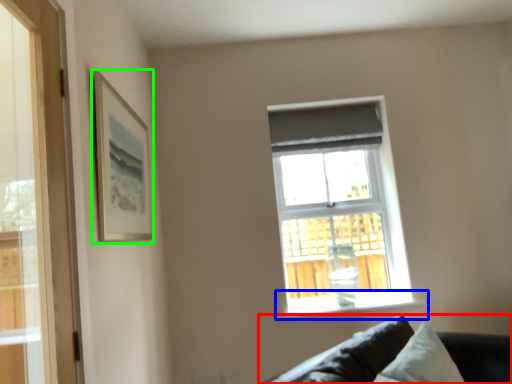
Question: Considering the real-world distances, which object is farthest from studio couch (highlighted by a red box)? window sill (highlighted by a blue box) or picture frame (highlighted by a green box)?

Choices:
 (A) window sill
 (B) picture frame

Answer: (B)